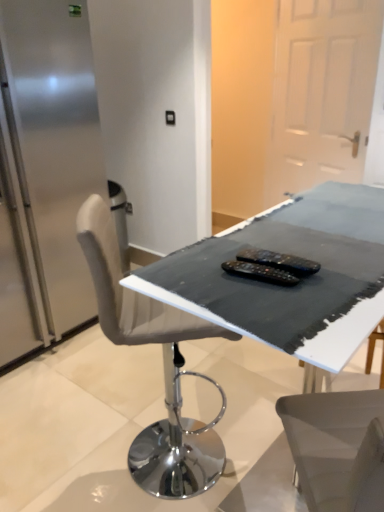
Find the location of a particular element. The image size is (384, 512). free space in front of black plastic remote controls at center, arranged as the 2th equipment when viewed from the top is located at coordinates (268, 308).